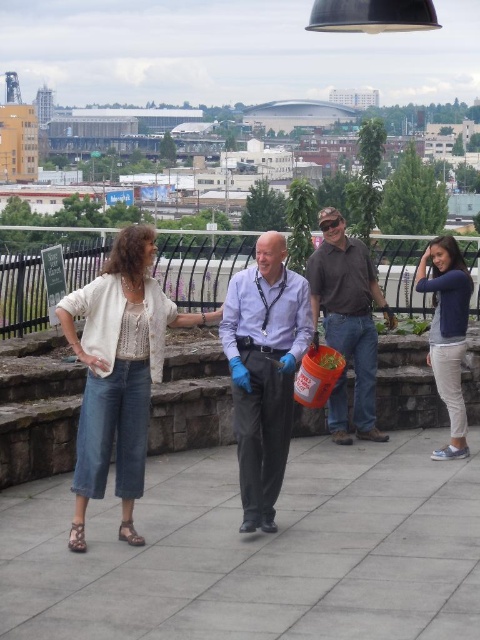
You are a photographer setting up a camera on a tripod. You need to position the camera so that both the denim pants at center and the matte blue shirt at center are in focus. The camera has a depth of field that can cover objects within 2 meters of each other. Can you achieve this without moving the camera?

The denim pants at center and the matte blue shirt at center are 1.98 meters apart from each other. Since the distance between them is within the camera depth of field range of 2 meters, the photographer can position the camera so both are in focus without moving it.